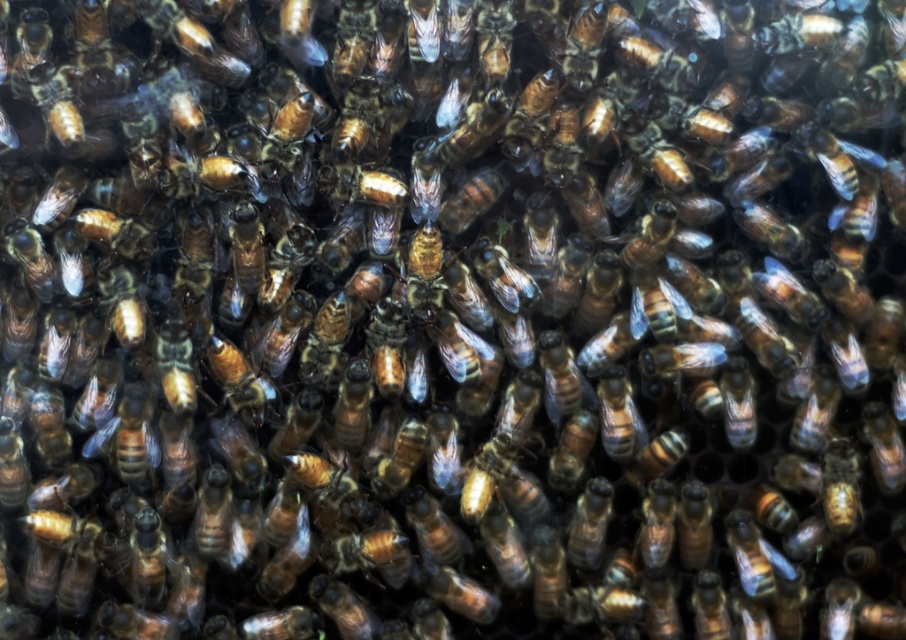
You are a beekeeper examining a honeycomb. You notice two bees at the center of the swarm. One is labeled as the shiny golden bee at center and the other as the brown shiny bee at center. Which of these two bees is smaller in size?

The shiny golden bee at center is smaller in size compared to the brown shiny bee at center.

In the closeup of the bee swarm, there is a shiny golden bee at bottom right and a shiny brown bee at center. Which of these two bees appears smaller in size?

The shiny golden bee at bottom right is shorter than the shiny brown bee at center, so it appears smaller in size.